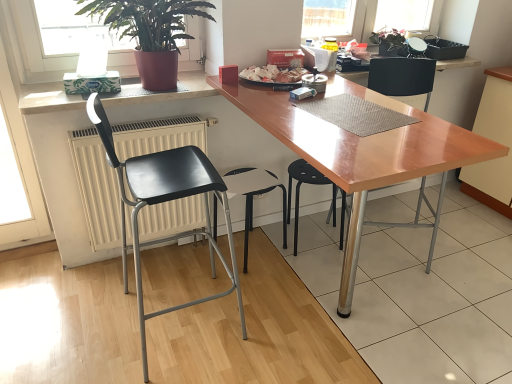
Identify the location of vacant space underneath black matte chair at left, acting as the 1th chair starting from the left (from a real-world perspective). This screenshot has width=512, height=384. (186, 326).